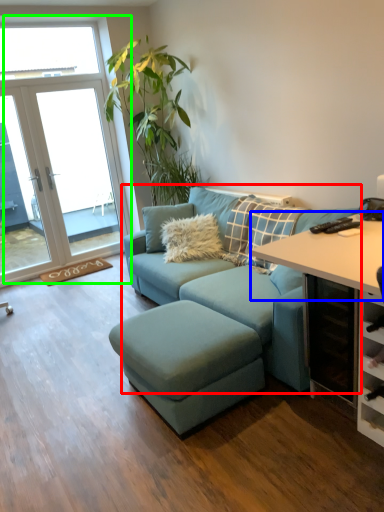
Question: Estimate the real-world distances between objects in this image. Which object is farther from studio couch (highlighted by a red box), table (highlighted by a blue box) or window (highlighted by a green box)?

Choices:
 (A) table
 (B) window

Answer: (B)